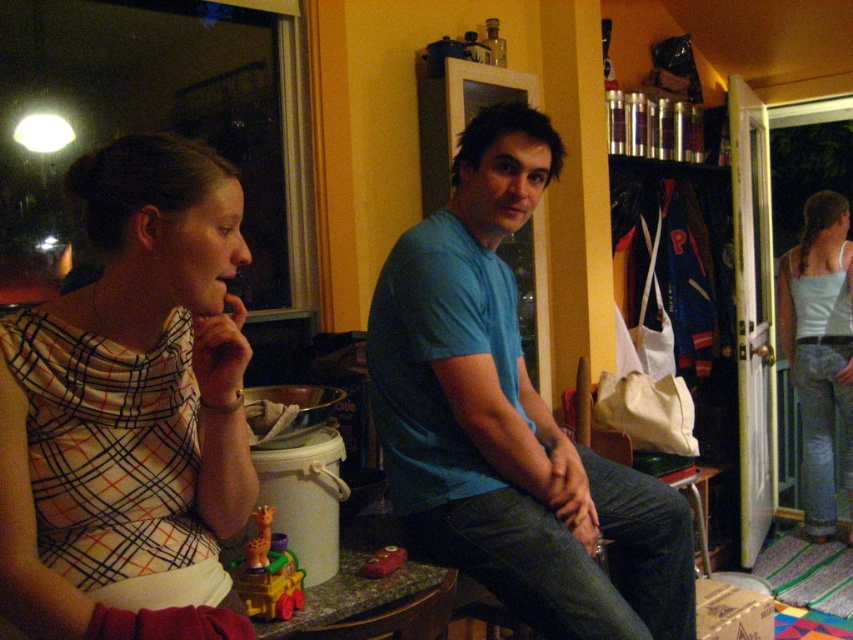
Which is behind, point (827, 476) or point (285, 552)?

Point (827, 476)

Locate an element on the screen. Image resolution: width=853 pixels, height=640 pixels. light blue tank top at right is located at coordinates (819, 348).

I want to click on light blue tank top at right, so click(819, 348).

Is blue cotton shirt at center further to the viewer compared to rubber yellow train at center?

Yes, blue cotton shirt at center is behind rubber yellow train at center.

The image size is (853, 640). Describe the element at coordinates (508, 419) in the screenshot. I see `blue cotton shirt at center` at that location.

Between point (416, 525) and point (294, 586), which one is positioned behind?

Point (416, 525)

In order to click on blue cotton shirt at center in this screenshot , I will do [x=508, y=419].

Is matte blue shirt at center wider than blue cotton shirt at center?

No, matte blue shirt at center is not wider than blue cotton shirt at center.

Is matte blue shirt at center to the right of blue cotton shirt at center from the viewer's perspective?

No, matte blue shirt at center is not to the right of blue cotton shirt at center.

Locate an element on the screen. matte blue shirt at center is located at coordinates (123, 406).

The width and height of the screenshot is (853, 640). In order to click on matte blue shirt at center in this screenshot , I will do `click(123, 406)`.